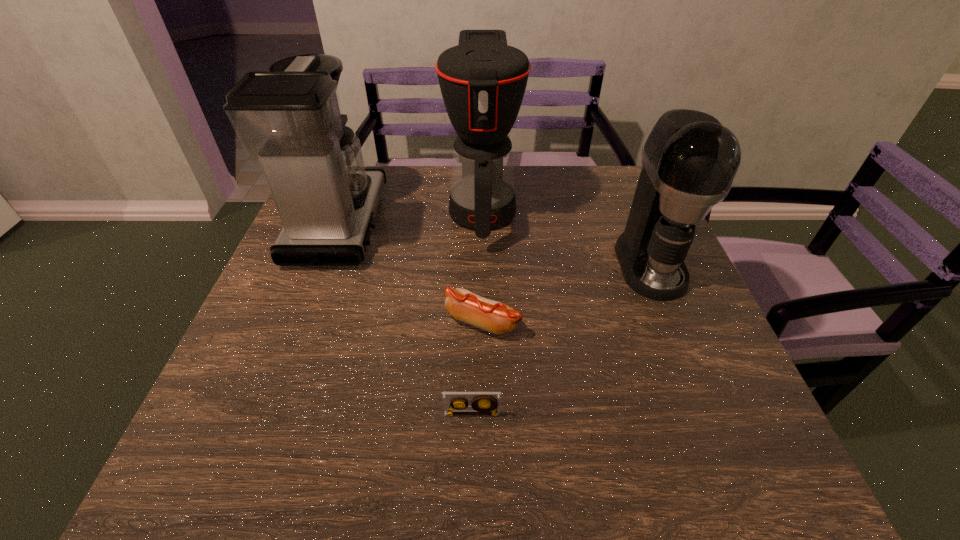
You are a GUI agent. You are given a task and a screenshot of the screen. Output one action in this format:
    pyautogui.click(x=<x>, y=<y>)
    Task: Click on the vacant space that satisfies the following two spatial constraints: 1. on the back side of the sausage; 2. at the front of the leftmost object where the controls are located
    
    Given the screenshot: What is the action you would take?
    pyautogui.click(x=482, y=223)

Identify the location of free space that satisfies the following two spatial constraints: 1. pour from the carafe of the second coffee maker from left to right; 2. at the front of the leftmost coffee maker where the controls are located. (483, 223).